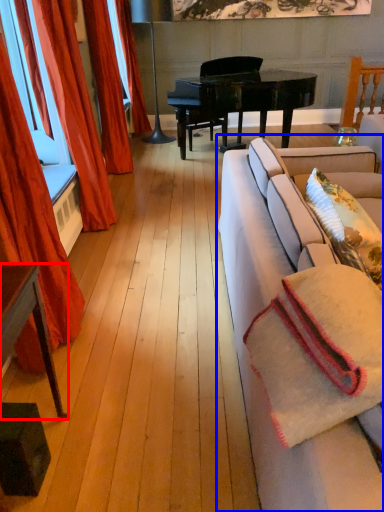
Question: Which object is further to the camera taking this photo, table (highlighted by a red box) or studio couch (highlighted by a blue box)?

Choices:
 (A) table
 (B) studio couch

Answer: (A)